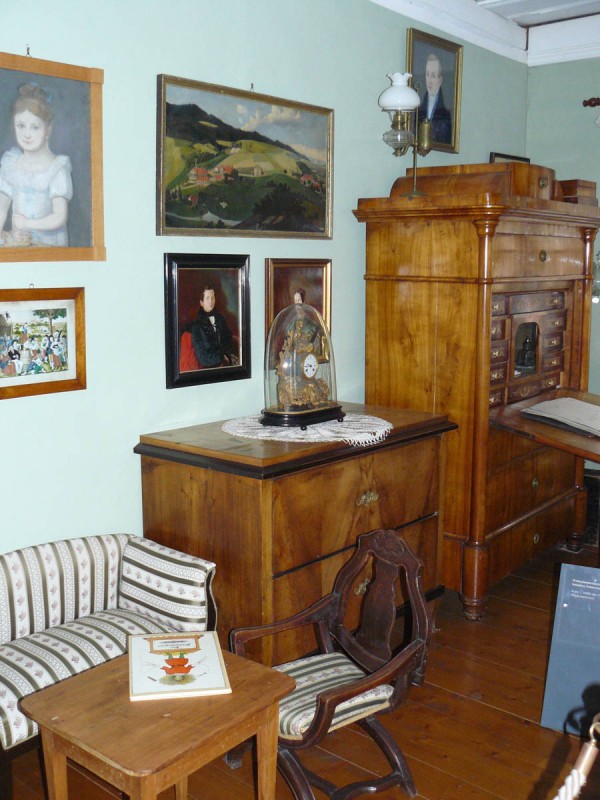
You are a GUI agent. You are given a task and a screenshot of the screen. Output one action in this format:
    pyautogui.click(x=<x>, y=<y>)
    Task: Click on the dreser
    This screenshot has width=600, height=800.
    Given the screenshot: What is the action you would take?
    pyautogui.click(x=310, y=482), pyautogui.click(x=486, y=350)